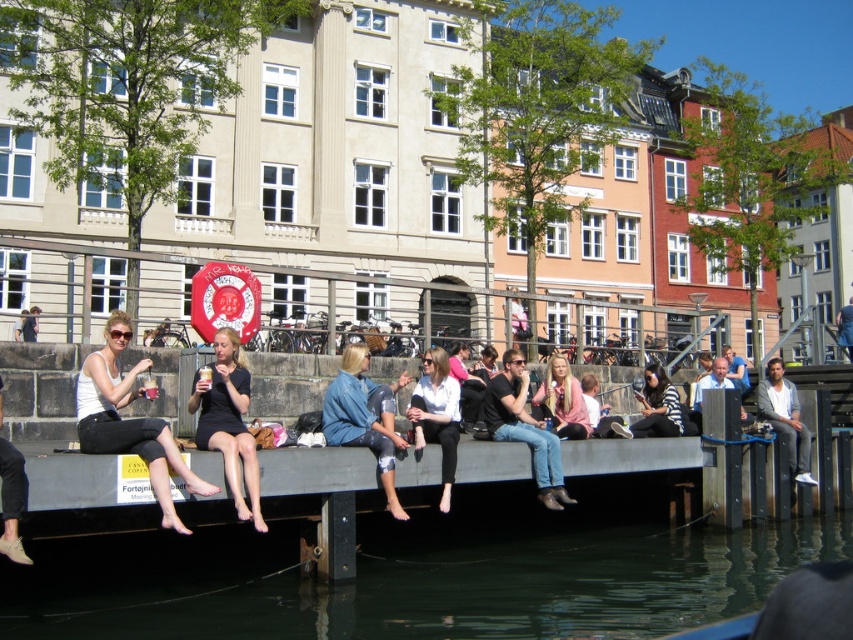
You are a fashion designer observing the canal scene. You notice two garments worn by people on the dock. The first is a matte white tank top at left, and the second is a pink fabric jacket at center. Which garment has a shorter length?

The matte white tank top at left is shorter than the pink fabric jacket at center.

You are a photographer standing on the canal side. You see a person wearing a matte white tank top at left and dark blue jeans at center. Which piece of clothing is positioned more to the left?

The matte white tank top at left is positioned more to the left than the dark blue jeans at center.